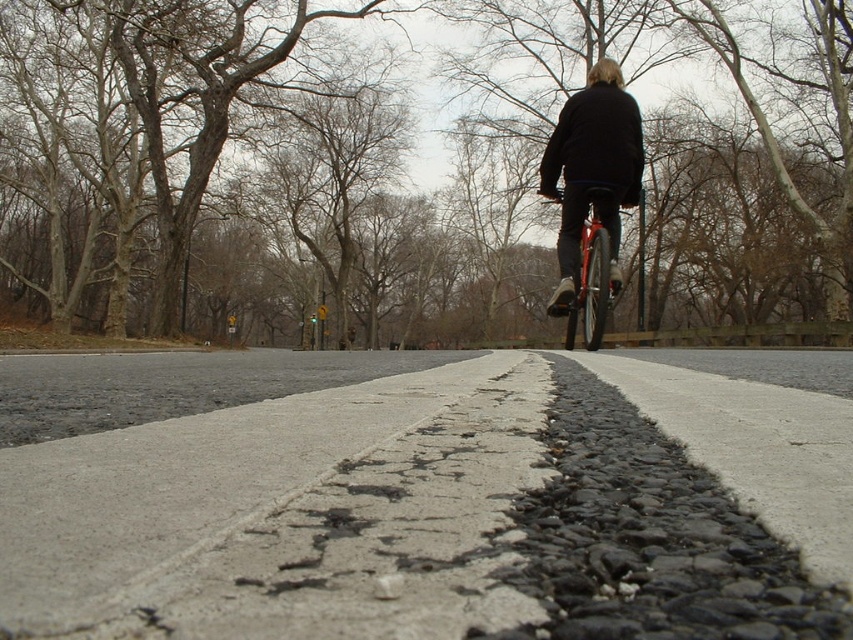
Question: Which of the following is the closest to the observer?

Choices:
 (A) (6, 572)
 (B) (567, 326)

Answer: (A)

Question: Does asphalt at center appear under shiny red bicycle at center?

Choices:
 (A) no
 (B) yes

Answer: (B)

Question: Which point is farther to the camera?

Choices:
 (A) shiny red bicycle at center
 (B) asphalt at center

Answer: (A)

Question: Considering the relative positions of asphalt at center and shiny red bicycle at center in the image provided, where is asphalt at center located with respect to shiny red bicycle at center?

Choices:
 (A) right
 (B) left

Answer: (B)

Question: Considering the relative positions of asphalt at center and shiny red bicycle at center in the image provided, where is asphalt at center located with respect to shiny red bicycle at center?

Choices:
 (A) left
 (B) right

Answer: (A)